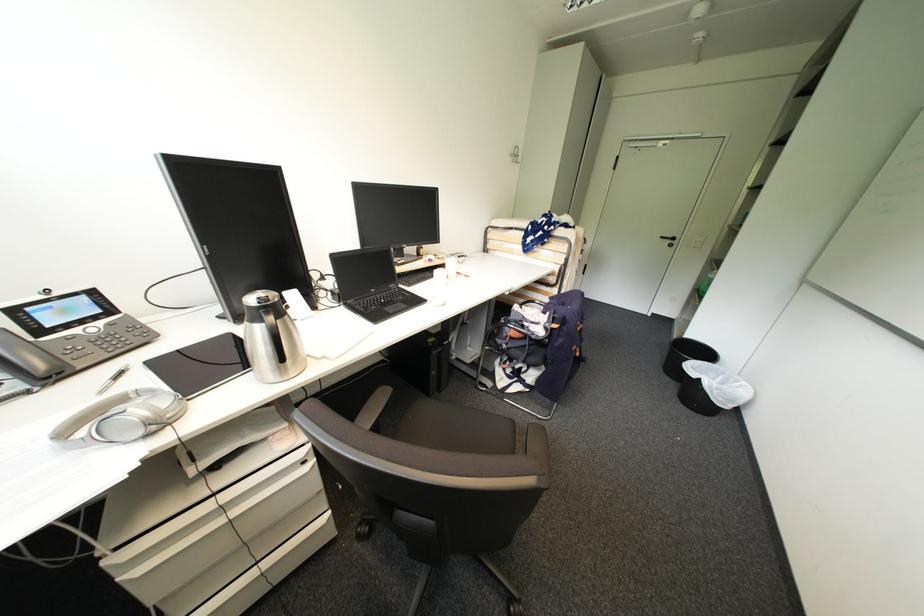
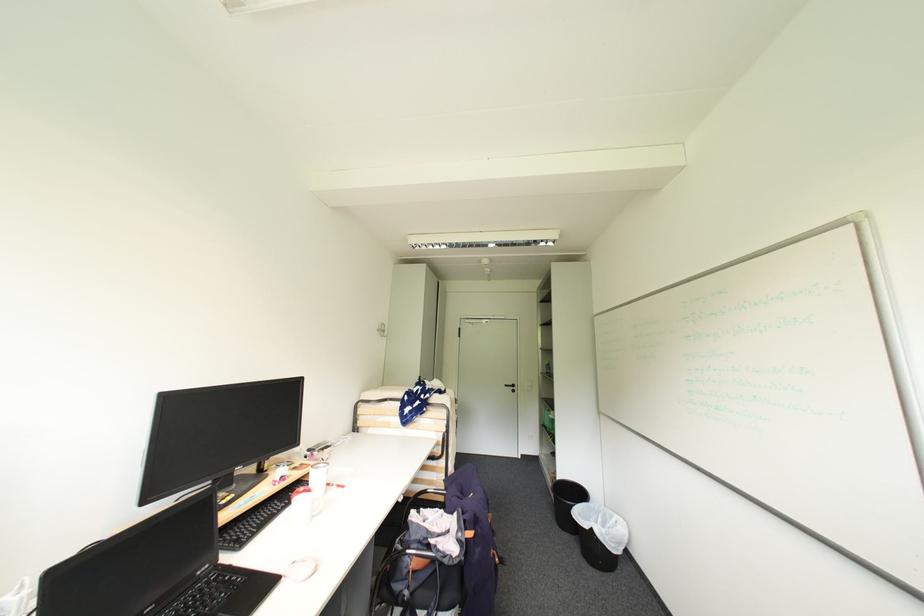
The first image is from the beginning of the video and the second image is from the end. How did the camera likely rotate when shooting the video?

The rotation direction of the camera is right-up.